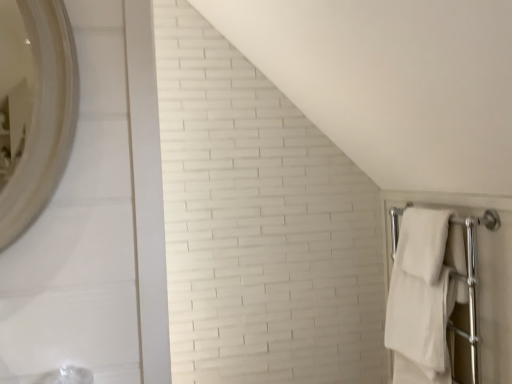
Question: From the image's perspective, is white soft towel at right, the 2th bath towel in the bottom-to-top sequence, beneath white soft towel at right, which appears as the 2th bath towel when viewed from the top?

Choices:
 (A) no
 (B) yes

Answer: (A)

Question: Is white soft towel at right, the 2th bath towel in the bottom-to-top sequence, closer to the viewer compared to white soft towel at right, which is the first bath towel in bottom-to-top order?

Choices:
 (A) yes
 (B) no

Answer: (A)

Question: Is white soft towel at right, which appears as the 2th bath towel when viewed from the top, a part of white soft towel at right, the 2th bath towel in the bottom-to-top sequence?

Choices:
 (A) no
 (B) yes

Answer: (A)

Question: Can you confirm if white soft towel at right, the 2th bath towel in the bottom-to-top sequence, is thinner than white soft towel at right, which is the first bath towel in bottom-to-top order?

Choices:
 (A) no
 (B) yes

Answer: (B)

Question: Is white soft towel at right, the 2th bath towel in the bottom-to-top sequence, next to white soft towel at right, which is the first bath towel in bottom-to-top order, and touching it?

Choices:
 (A) yes
 (B) no

Answer: (A)

Question: Would you consider white soft towel at right, the 2th bath towel in the bottom-to-top sequence, to be distant from white soft towel at right, which is the first bath towel in bottom-to-top order?

Choices:
 (A) yes
 (B) no

Answer: (B)

Question: Can we say white soft towel at right, which is the first bath towel in bottom-to-top order, lies outside white soft towel at right, which is the first bath towel in top-to-bottom order?

Choices:
 (A) no
 (B) yes

Answer: (B)

Question: From the image's perspective, would you say white soft towel at right, which is the first bath towel in bottom-to-top order, is positioned over white soft towel at right, the 2th bath towel in the bottom-to-top sequence?

Choices:
 (A) yes
 (B) no

Answer: (B)

Question: Considering the relative positions of white soft towel at right, which appears as the 2th bath towel when viewed from the top, and white soft towel at right, the 2th bath towel in the bottom-to-top sequence, in the image provided, is white soft towel at right, which appears as the 2th bath towel when viewed from the top, to the right of white soft towel at right, the 2th bath towel in the bottom-to-top sequence, from the viewer's perspective?

Choices:
 (A) no
 (B) yes

Answer: (A)

Question: Is white soft towel at right, which appears as the 2th bath towel when viewed from the top, in front of white soft towel at right, the 2th bath towel in the bottom-to-top sequence?

Choices:
 (A) yes
 (B) no

Answer: (B)

Question: From a real-world perspective, does white soft towel at right, which appears as the 2th bath towel when viewed from the top, stand above white soft towel at right, the 2th bath towel in the bottom-to-top sequence?

Choices:
 (A) yes
 (B) no

Answer: (B)

Question: Is white soft towel at right, which appears as the 2th bath towel when viewed from the top, not near white soft towel at right, which is the first bath towel in top-to-bottom order?

Choices:
 (A) yes
 (B) no

Answer: (B)

Question: Is point tap(429, 244) positioned closer to the camera than point tap(414, 339)?

Choices:
 (A) closer
 (B) farther

Answer: (A)